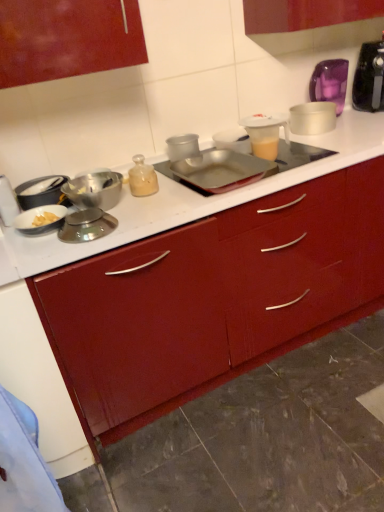
Question: Is the position of translucent plastic mixer at upper right more distant than that of matte silver bowl at left, acting as the sixth kitchen appliance starting from the right?

Choices:
 (A) no
 (B) yes

Answer: (B)

Question: Does translucent plastic mixer at upper right appear on the right side of matte silver bowl at left, acting as the sixth kitchen appliance starting from the right?

Choices:
 (A) no
 (B) yes

Answer: (B)

Question: Can you confirm if translucent plastic mixer at upper right is thinner than matte silver bowl at left, acting as the sixth kitchen appliance starting from the right?

Choices:
 (A) yes
 (B) no

Answer: (B)

Question: From the image's perspective, is translucent plastic mixer at upper right located above matte silver bowl at left, which ranks as the second kitchen appliance in left-to-right order?

Choices:
 (A) yes
 (B) no

Answer: (A)

Question: From a real-world perspective, does translucent plastic mixer at upper right sit lower than matte silver bowl at left, acting as the sixth kitchen appliance starting from the right?

Choices:
 (A) no
 (B) yes

Answer: (A)

Question: Can you confirm if translucent plastic mixer at upper right is smaller than matte silver bowl at left, which ranks as the second kitchen appliance in left-to-right order?

Choices:
 (A) yes
 (B) no

Answer: (B)

Question: Could purple glass jar at upper right, the 2th appliance positioned from the front, be considered to be inside shiny silver bowl at left, marked as the 4th kitchen appliance in a left-to-right arrangement?

Choices:
 (A) yes
 (B) no

Answer: (B)

Question: Is shiny silver bowl at left, the fourth kitchen appliance when ordered from right to left, oriented towards purple glass jar at upper right, the 1th appliance positioned from the top?

Choices:
 (A) yes
 (B) no

Answer: (B)

Question: From a real-world perspective, is shiny silver bowl at left, marked as the 4th kitchen appliance in a left-to-right arrangement, positioned over purple glass jar at upper right, the 1th appliance positioned from the top, based on gravity?

Choices:
 (A) yes
 (B) no

Answer: (B)

Question: Can you confirm if shiny silver bowl at left, the fourth kitchen appliance when ordered from right to left, is smaller than purple glass jar at upper right, the first appliance viewed from the back?

Choices:
 (A) yes
 (B) no

Answer: (A)

Question: Can you confirm if shiny silver bowl at left, the fourth kitchen appliance when ordered from right to left, is thinner than purple glass jar at upper right, the first appliance viewed from the back?

Choices:
 (A) yes
 (B) no

Answer: (B)

Question: Is shiny silver bowl at left, marked as the 4th kitchen appliance in a left-to-right arrangement, wider than purple glass jar at upper right, which is the second appliance in bottom-to-top order?

Choices:
 (A) no
 (B) yes

Answer: (B)

Question: Can you confirm if matte silver bowl at left, acting as the sixth kitchen appliance starting from the right, is wider than shiny silver bowl at left, the fourth kitchen appliance when ordered from right to left?

Choices:
 (A) no
 (B) yes

Answer: (B)